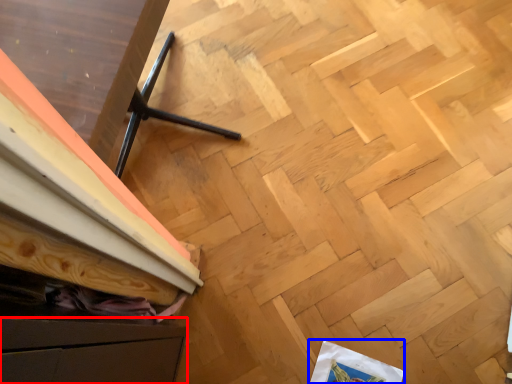
Question: Which object appears closest to the camera in this image, drawer (highlighted by a red box) or wrapping paper (highlighted by a blue box)?

Choices:
 (A) drawer
 (B) wrapping paper

Answer: (A)